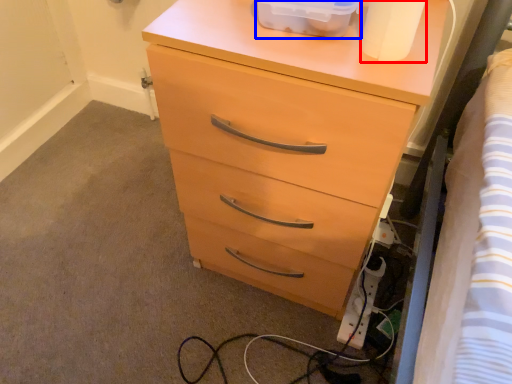
Question: Which of the following is the farthest to the observer, toilet paper (highlighted by a red box) or storage box (highlighted by a blue box)?

Choices:
 (A) toilet paper
 (B) storage box

Answer: (B)